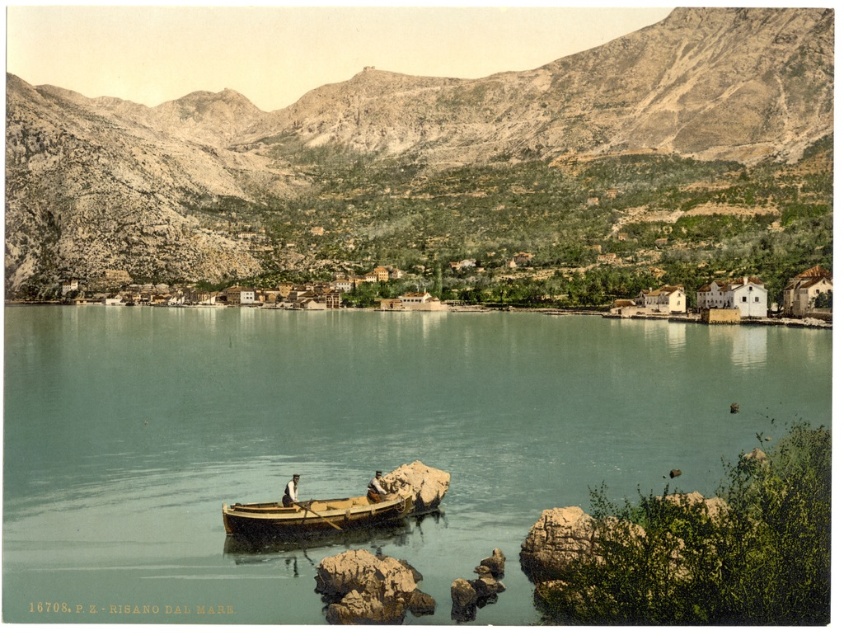
Question: Estimate the real-world distances between objects in this image. Which object is closer to the wooden canoe at center?

Choices:
 (A) clear blue water at center
 (B) rugged stone mountain at center
 (C) wooden boat at lower center

Answer: (C)

Question: Based on their relative distances, which object is nearer to the wooden boat at lower center?

Choices:
 (A) wooden canoe at center
 (B) clear blue water at center

Answer: (A)

Question: Is rugged stone mountain at center wider than wooden canoe at center?

Choices:
 (A) yes
 (B) no

Answer: (A)

Question: Observing the image, what is the correct spatial positioning of clear blue water at center in reference to wooden boat at lower center?

Choices:
 (A) above
 (B) below

Answer: (A)

Question: Observing the image, what is the correct spatial positioning of wooden boat at lower center in reference to wooden canoe at center?

Choices:
 (A) left
 (B) right

Answer: (A)

Question: Which object is farther from the camera taking this photo?

Choices:
 (A) wooden canoe at center
 (B) wooden boat at lower center
 (C) clear blue water at center

Answer: (B)